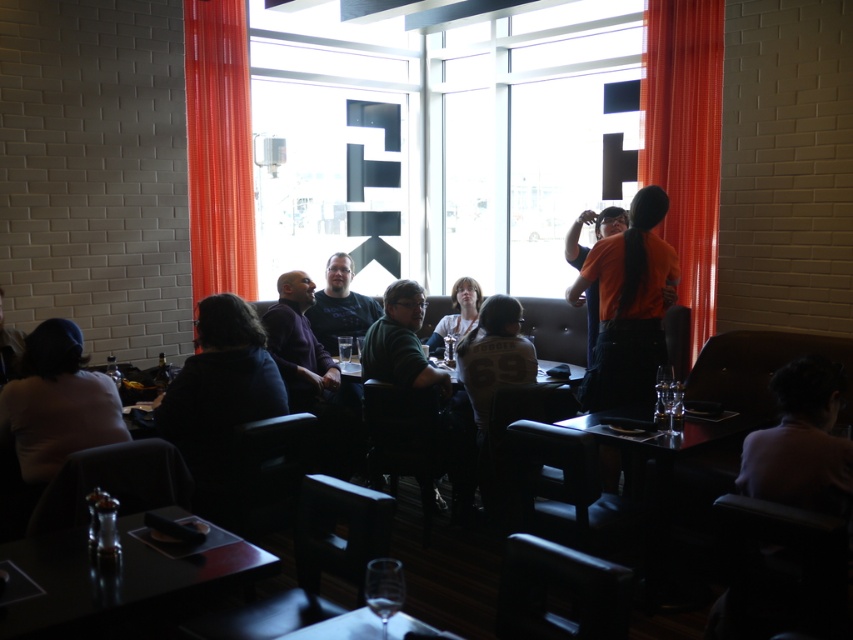
Question: Does dark blue sweater at lower left come behind matte black table at center?

Choices:
 (A) yes
 (B) no

Answer: (B)

Question: Which of these objects is positioned closest to the orange fabric curtain at left?

Choices:
 (A) matte gray sweater at center
 (B) matte black shirt at center
 (C) transparent glass window at center
 (D) dark purple sweater at center

Answer: (B)

Question: In this image, where is light pink fabric shirt at lower left located relative to light pink fabric shirt at lower right?

Choices:
 (A) below
 (B) above

Answer: (B)

Question: Which point appears closest to the camera in this image?

Choices:
 (A) (306, 406)
 (B) (711, 122)

Answer: (A)

Question: Which object is closer to the camera taking this photo?

Choices:
 (A) light pink fabric shirt at lower right
 (B) matte gray sweater at center
 (C) orange sheer curtain at right
 (D) matte black table at center

Answer: (A)

Question: Considering the relative positions of dark purple sweater at center and matte gray sweater at center in the image provided, where is dark purple sweater at center located with respect to matte gray sweater at center?

Choices:
 (A) above
 (B) below

Answer: (B)